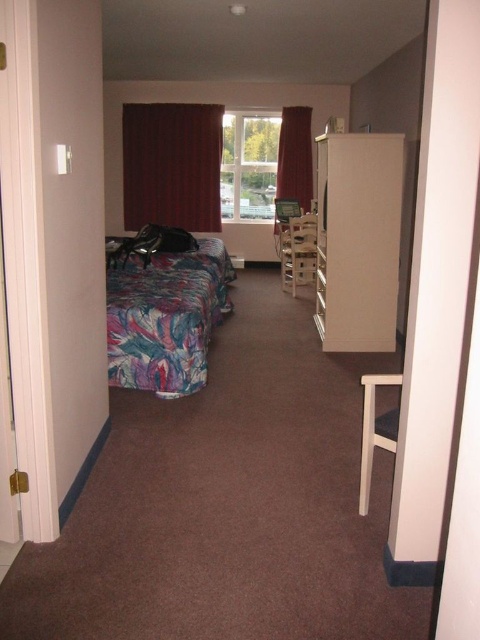
Question: Considering the relative positions of white glossy dresser at center and velvet red curtain at center in the image provided, where is white glossy dresser at center located with respect to velvet red curtain at center?

Choices:
 (A) right
 (B) left

Answer: (A)

Question: Which object appears farthest from the camera in this image?

Choices:
 (A) velvet burgundy curtain at center
 (B) white glossy dresser at center
 (C) velvet red curtain at center

Answer: (C)

Question: Does white glossy dresser at center appear on the left side of velvet red curtain at center?

Choices:
 (A) no
 (B) yes

Answer: (A)

Question: Which object is positioned farthest from the velvet red curtain at center?

Choices:
 (A) white plastic chair at center
 (B) velvet burgundy curtain at center

Answer: (A)

Question: Which object is farther from the camera taking this photo?

Choices:
 (A) velvet burgundy curtain at center
 (B) white glossy dresser at center
 (C) velvet red curtain at center
 (D) printed fabric bed at left

Answer: (C)

Question: Can you confirm if printed fabric bed at left is positioned below white plastic chair at center?

Choices:
 (A) yes
 (B) no

Answer: (B)